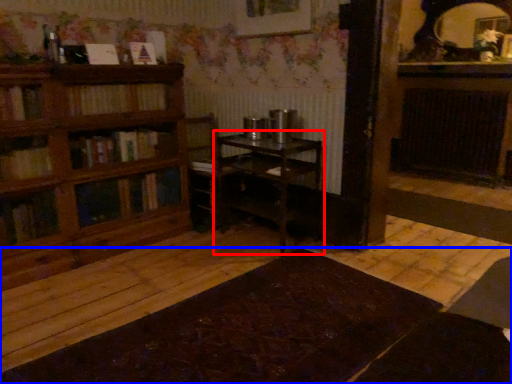
Question: Which object is closer to the camera taking this photo, table (highlighted by a red box) or table (highlighted by a blue box)?

Choices:
 (A) table
 (B) table

Answer: (B)